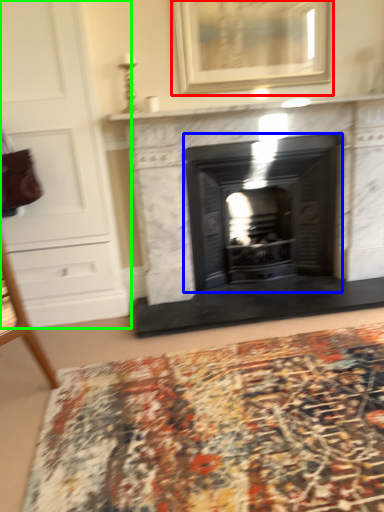
Question: Considering the real-world distances, which object is farthest from picture frame (highlighted by a red box)? wood burning stove (highlighted by a blue box) or dresser (highlighted by a green box)?

Choices:
 (A) wood burning stove
 (B) dresser

Answer: (B)